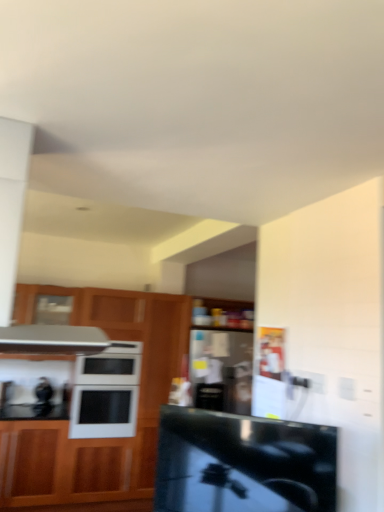
Question: Is white glossy microwave oven at center surrounding wooden cabinet at left?

Choices:
 (A) no
 (B) yes

Answer: (A)

Question: Are white glossy microwave oven at center and wooden cabinet at left located far from each other?

Choices:
 (A) no
 (B) yes

Answer: (A)

Question: From the image's perspective, is white glossy microwave oven at center located beneath wooden cabinet at left?

Choices:
 (A) yes
 (B) no

Answer: (B)

Question: Considering the relative sizes of white glossy microwave oven at center and wooden cabinet at left in the image provided, is white glossy microwave oven at center bigger than wooden cabinet at left?

Choices:
 (A) no
 (B) yes

Answer: (A)

Question: Is the depth of white glossy microwave oven at center less than that of wooden cabinet at left?

Choices:
 (A) no
 (B) yes

Answer: (A)

Question: Based on their positions, is black glossy countertop at center located to the left or right of white glossy microwave oven at center?

Choices:
 (A) left
 (B) right

Answer: (B)

Question: Is point (165, 477) closer or farther from the camera than point (82, 365)?

Choices:
 (A) farther
 (B) closer

Answer: (B)

Question: Is black glossy countertop at center situated inside white glossy microwave oven at center or outside?

Choices:
 (A) outside
 (B) inside

Answer: (A)

Question: Considering the positions of black glossy countertop at center and white glossy microwave oven at center in the image, is black glossy countertop at center wider or thinner than white glossy microwave oven at center?

Choices:
 (A) thin
 (B) wide

Answer: (A)

Question: Looking at their shapes, would you say wooden cabinet at left is wider or thinner than white glossy microwave oven at center?

Choices:
 (A) wide
 (B) thin

Answer: (A)

Question: From the image's perspective, is wooden cabinet at left located above or below white glossy microwave oven at center?

Choices:
 (A) above
 (B) below

Answer: (B)

Question: Considering the positions of wooden cabinet at left and white glossy microwave oven at center in the image, is wooden cabinet at left bigger or smaller than white glossy microwave oven at center?

Choices:
 (A) small
 (B) big

Answer: (B)

Question: From a real-world perspective, is wooden cabinet at left positioned above or below white glossy microwave oven at center?

Choices:
 (A) below
 (B) above

Answer: (A)

Question: Is black glossy countertop at center taller or shorter than wooden cabinet at left?

Choices:
 (A) short
 (B) tall

Answer: (A)

Question: Based on their positions, is black glossy countertop at center located to the left or right of wooden cabinet at left?

Choices:
 (A) left
 (B) right

Answer: (B)